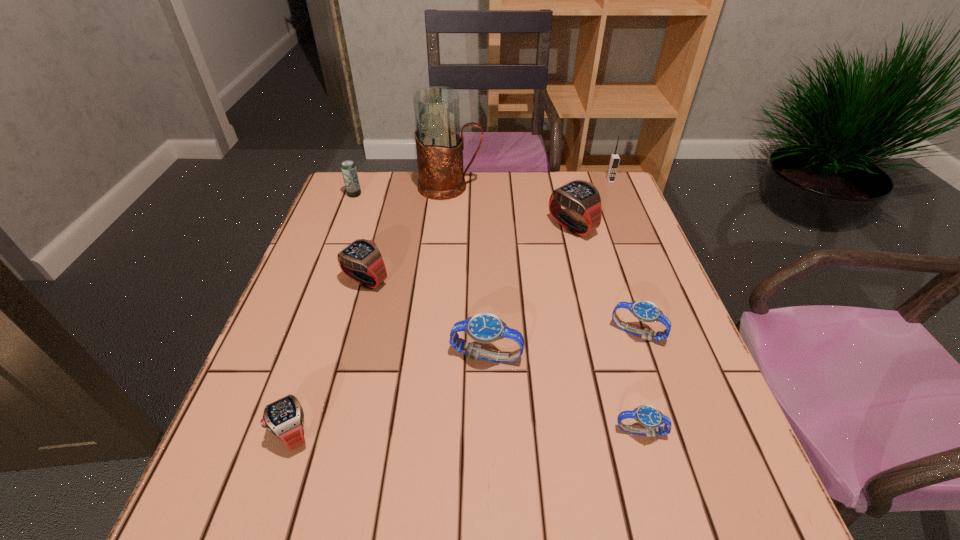
I want to click on the second closest watch to the second farthest red watch, so click(284, 418).

Locate an element on the screen. The width and height of the screenshot is (960, 540). watch that is the third closest to the beer can is located at coordinates (485, 327).

The width and height of the screenshot is (960, 540). In order to click on red watch that can be found as the second closest to the beer can in this screenshot , I will do `click(579, 196)`.

Image resolution: width=960 pixels, height=540 pixels. Identify the location of red watch that is the second closest to the fifth nearest watch. (579, 196).

At what (x,y) coordinates should I click in order to perform the action: click on blue watch identified as the closest to the gray pitcher. Please return your answer as a coordinate pair (x, y). The height and width of the screenshot is (540, 960). Looking at the image, I should click on (485, 327).

Locate which blue watch ranks third in proximity to the rightmost object. Please provide its 2D coordinates. Your answer should be formatted as a tuple, i.e. [(x, y)], where the tuple contains the x and y coordinates of a point satisfying the conditions above.

[(651, 418)]

I want to click on free space that satisfies the following two spatial constraints: 1. with the handle on the side of the gray pitcher; 2. on the right side of the second smallest blue watch, so click(437, 333).

I want to click on free spot that satisfies the following two spatial constraints: 1. on the front side of the beer can; 2. on the right side of the smallest blue watch, so click(x=264, y=432).

Where is `free space that satisfies the following two spatial constraints: 1. with the handle on the side of the tallest object; 2. on the back side of the second biggest blue watch`? free space that satisfies the following two spatial constraints: 1. with the handle on the side of the tallest object; 2. on the back side of the second biggest blue watch is located at coordinates pyautogui.click(x=437, y=333).